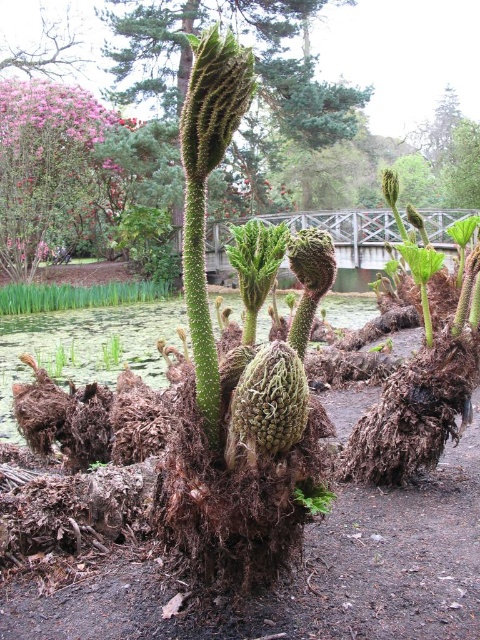
The image size is (480, 640). In order to click on green fuzzy plant at center in this screenshot , I will do `click(255, 72)`.

Does green fuzzy plant at center lie in front of pink fluffy flower at upper left?

No, green fuzzy plant at center is further to the viewer.

Between point (283, 56) and point (8, 83), which one is positioned behind?

Point (283, 56)

Find the location of a particular element. This screenshot has width=480, height=640. green fuzzy plant at center is located at coordinates (255, 72).